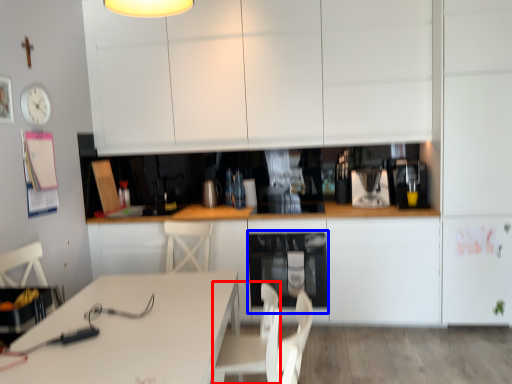
Question: Among these objects, which one is nearest to the camera, swivel chair (highlighted by a red box) or oven (highlighted by a blue box)?

Choices:
 (A) swivel chair
 (B) oven

Answer: (A)